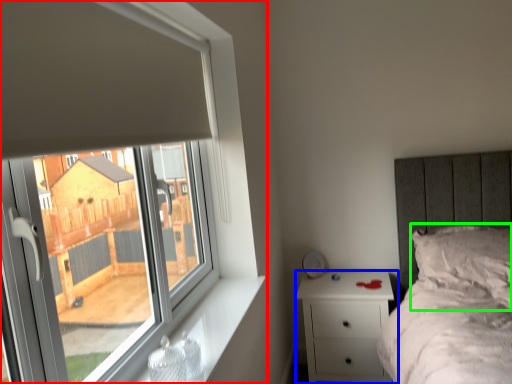
Question: Which object is the farthest from window (highlighted by a red box)? Choose among these: nightstand (highlighted by a blue box) or pillow (highlighted by a green box).

Choices:
 (A) nightstand
 (B) pillow

Answer: (B)